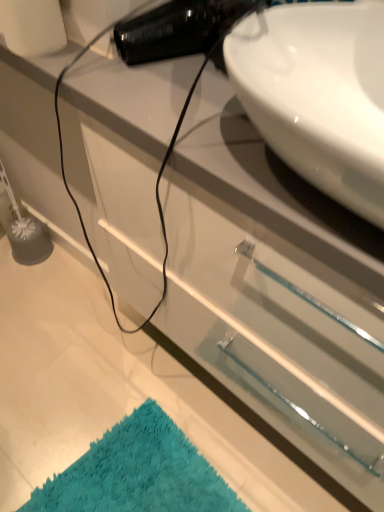
Question: From the image's perspective, is white glossy sink at upper right beneath teal shaggy bath mat at lower left?

Choices:
 (A) yes
 (B) no

Answer: (B)

Question: From the image's perspective, is white glossy sink at upper right on teal shaggy bath mat at lower left?

Choices:
 (A) no
 (B) yes

Answer: (B)

Question: Is white glossy sink at upper right shorter than teal shaggy bath mat at lower left?

Choices:
 (A) yes
 (B) no

Answer: (B)

Question: Is the position of white glossy sink at upper right more distant than that of teal shaggy bath mat at lower left?

Choices:
 (A) no
 (B) yes

Answer: (A)

Question: Does white glossy sink at upper right appear on the right side of teal shaggy bath mat at lower left?

Choices:
 (A) yes
 (B) no

Answer: (A)

Question: Considering the relative sizes of white glossy sink at upper right and teal shaggy bath mat at lower left in the image provided, is white glossy sink at upper right wider than teal shaggy bath mat at lower left?

Choices:
 (A) yes
 (B) no

Answer: (A)

Question: Is teal shaggy bath mat at lower left next to white glossy sink at upper right and touching it?

Choices:
 (A) no
 (B) yes

Answer: (A)

Question: Considering the relative positions of teal shaggy bath mat at lower left and white glossy sink at upper right in the image provided, is teal shaggy bath mat at lower left to the right of white glossy sink at upper right from the viewer's perspective?

Choices:
 (A) yes
 (B) no

Answer: (B)

Question: Would you say teal shaggy bath mat at lower left contains white glossy sink at upper right?

Choices:
 (A) no
 (B) yes

Answer: (A)

Question: Can you confirm if teal shaggy bath mat at lower left is bigger than white glossy sink at upper right?

Choices:
 (A) yes
 (B) no

Answer: (B)

Question: Is the position of teal shaggy bath mat at lower left less distant than that of white glossy sink at upper right?

Choices:
 (A) no
 (B) yes

Answer: (A)

Question: Is teal shaggy bath mat at lower left to the left of white glossy sink at upper right from the viewer's perspective?

Choices:
 (A) yes
 (B) no

Answer: (A)

Question: Do you think teal shaggy bath mat at lower left is within white glossy sink at upper right, or outside of it?

Choices:
 (A) outside
 (B) inside

Answer: (A)